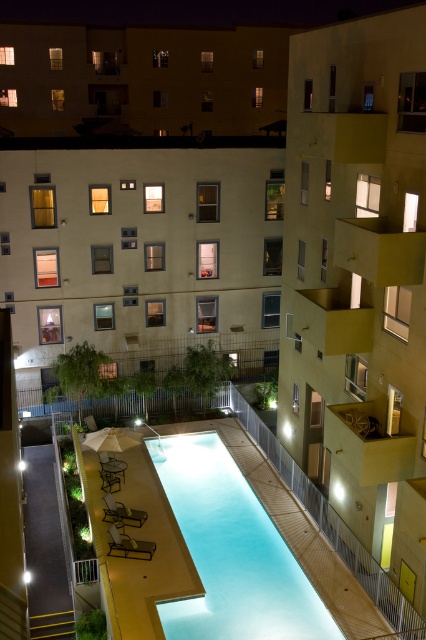
Question: Estimate the real-world distances between objects in this image. Which object is farther from the yellow concrete balcony at upper right?

Choices:
 (A) beige concrete building at center
 (B) smooth concrete pool at center

Answer: (A)

Question: Is yellow concrete balcony at upper right thinner than beige concrete building at center?

Choices:
 (A) yes
 (B) no

Answer: (A)

Question: Which point is farther to the camera?

Choices:
 (A) (290, 228)
 (B) (215, 440)
 (C) (158, 284)

Answer: (C)

Question: Which point appears farthest from the camera in this image?

Choices:
 (A) (227, 248)
 (B) (175, 461)
 (C) (285, 288)

Answer: (A)

Question: Is yellow concrete balcony at upper right to the right of beige concrete building at center from the viewer's perspective?

Choices:
 (A) yes
 (B) no

Answer: (A)

Question: Does yellow concrete balcony at upper right appear on the left side of smooth concrete pool at center?

Choices:
 (A) yes
 (B) no

Answer: (B)